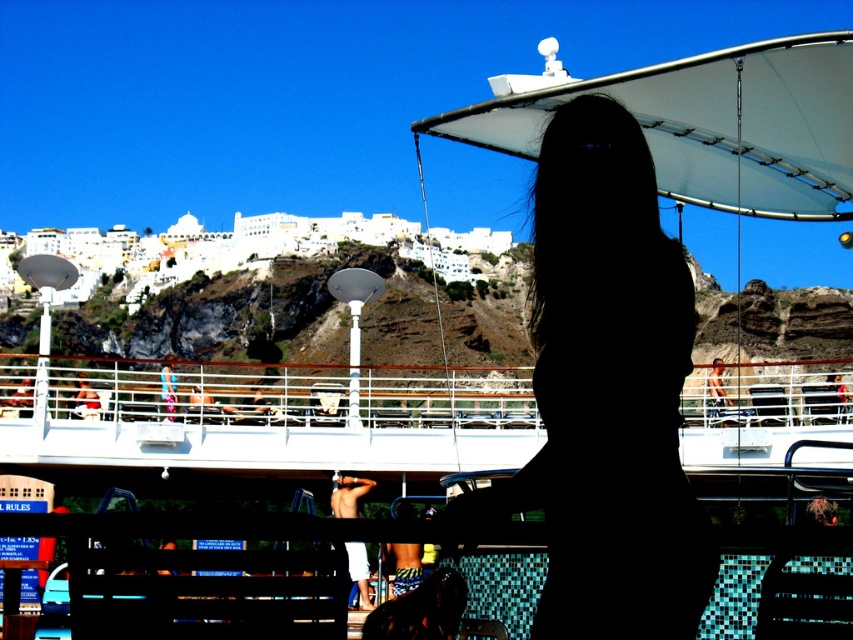
Question: Can you confirm if tan skin man at upper right is bigger than white fabric towel at upper center?

Choices:
 (A) no
 (B) yes

Answer: (B)

Question: Which object is closer to the camera taking this photo?

Choices:
 (A) black silhouette at center
 (B) white matte canopy at upper center
 (C) pink fabric bikini at center

Answer: (A)

Question: Which point is farther to the camera?

Choices:
 (A) black silhouette at center
 (B) tan skin man at upper right

Answer: (B)

Question: Can you confirm if white cotton shorts at center is bigger than yellow striped shorts at center?

Choices:
 (A) no
 (B) yes

Answer: (B)

Question: Is white matte canopy at upper center below yellow striped shorts at center?

Choices:
 (A) yes
 (B) no

Answer: (B)

Question: Among these points, which one is nearest to the camera?

Choices:
 (A) [524, 483]
 (B) [409, 508]
 (C) [79, 406]
 (D) [347, 545]

Answer: (A)